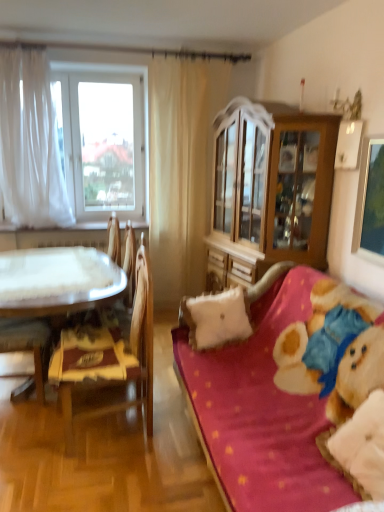
This screenshot has width=384, height=512. What do you see at coordinates (102, 142) in the screenshot?
I see `white sheer curtain at left` at bounding box center [102, 142].

Image resolution: width=384 pixels, height=512 pixels. I want to click on white sheer curtain at left, the 2th curtain positioned from the right, so click(30, 143).

The image size is (384, 512). What do you see at coordinates (260, 412) in the screenshot?
I see `velvet pink couch at right` at bounding box center [260, 412].

What do you see at coordinates (370, 201) in the screenshot? This screenshot has height=512, width=384. I see `metallic silver picture frame at upper right` at bounding box center [370, 201].

Locate an element on the screen. white glossy table at left is located at coordinates (57, 281).

In the scene shown: Which is closer to the camera, (362, 238) or (81, 142)?

The point (362, 238) is closer to the camera.

Which object is more forward, metallic silver picture frame at upper right or white sheer curtain at left?

Positioned in front is metallic silver picture frame at upper right.

Is metallic silver picture frame at upper right taller or shorter than white sheer curtain at left?

Clearly, metallic silver picture frame at upper right is shorter compared to white sheer curtain at left.

Consider the image. Are metallic silver picture frame at upper right and white sheer curtain at left far apart?

metallic silver picture frame at upper right is positioned a significant distance from white sheer curtain at left.

Does white sheer curtain at left, positioned as the first curtain in left-to-right order, have a greater height compared to white sheer curtain at left?

Correct, white sheer curtain at left, positioned as the first curtain in left-to-right order, is much taller as white sheer curtain at left.

Is white sheer curtain at left, the 2th curtain positioned from the right, facing away from white sheer curtain at left?

Yes, white sheer curtain at left, the 2th curtain positioned from the right, is facing away from white sheer curtain at left.

Considering the sizes of objects white sheer curtain at left, positioned as the first curtain in left-to-right order, and white sheer curtain at left in the image provided, who is bigger, white sheer curtain at left, positioned as the first curtain in left-to-right order, or white sheer curtain at left?

With larger size is white sheer curtain at left, positioned as the first curtain in left-to-right order.

From the picture: Can you tell me how much velvet pink couch at right and white glossy table at left differ in facing direction?

There is a 97.4-degree angle between the facing directions of velvet pink couch at right and white glossy table at left.

Considering the relative positions of velvet pink couch at right and white glossy table at left in the image provided, is velvet pink couch at right in front of white glossy table at left?

That is True.

From the image's perspective, would you say velvet pink couch at right is shown under white glossy table at left?

Yes, from the image's perspective, velvet pink couch at right is beneath white glossy table at left.

The width and height of the screenshot is (384, 512). I want to click on table that appears behind the velvet pink couch at right, so click(x=57, y=281).

Considering the relative positions of white sheer curtain at left, the 2th curtain positioned from the right, and velvet pink couch at right in the image provided, is white sheer curtain at left, the 2th curtain positioned from the right, to the right of velvet pink couch at right from the viewer's perspective?

In fact, white sheer curtain at left, the 2th curtain positioned from the right, is to the left of velvet pink couch at right.

From the image's perspective, would you say white sheer curtain at left, positioned as the first curtain in left-to-right order, is positioned over velvet pink couch at right?

Yes, from the image's perspective, white sheer curtain at left, positioned as the first curtain in left-to-right order, is over velvet pink couch at right.

Choose the correct answer: Is white sheer curtain at left, the 2th curtain positioned from the right, inside velvet pink couch at right or outside it?

white sheer curtain at left, the 2th curtain positioned from the right, lies outside velvet pink couch at right.

From a real-world perspective, relative to velvet pink couch at right, is white sheer curtain at left, positioned as the first curtain in left-to-right order, vertically above or below?

From a real-world perspective, white sheer curtain at left, positioned as the first curtain in left-to-right order, is physically above velvet pink couch at right.

Considering the sizes of objects beige fabric curtain at center, which is the 1th curtain from right to left, and white glossy table at left in the image provided, who is bigger, beige fabric curtain at center, which is the 1th curtain from right to left, or white glossy table at left?

white glossy table at left is bigger.

Choose the correct answer: Is beige fabric curtain at center, which is the 1th curtain from right to left, inside white glossy table at left or outside it?

beige fabric curtain at center, which is the 1th curtain from right to left, is spatially situated outside white glossy table at left.

Can you see beige fabric curtain at center, which is counted as the second curtain, starting from the left, touching white glossy table at left?

beige fabric curtain at center, which is counted as the second curtain, starting from the left, is not next to white glossy table at left, and they're not touching.

Can you confirm if beige fabric curtain at center, which is the 1th curtain from right to left, is thinner than white glossy table at left?

Indeed, beige fabric curtain at center, which is the 1th curtain from right to left, has a lesser width compared to white glossy table at left.

Can you confirm if white fluffy pillow at right, arranged as the second pillow when viewed from the back, is positioned to the left of metallic silver picture frame at upper right?

Yes, white fluffy pillow at right, arranged as the second pillow when viewed from the back, is to the left of metallic silver picture frame at upper right.

Considering the sizes of objects white fluffy pillow at right, the second pillow viewed from the left, and metallic silver picture frame at upper right in the image provided, who is shorter, white fluffy pillow at right, the second pillow viewed from the left, or metallic silver picture frame at upper right?

white fluffy pillow at right, the second pillow viewed from the left.

From the image's perspective, is white fluffy pillow at right, which is the 1th pillow from front to back, above metallic silver picture frame at upper right?

No, from the image's perspective, white fluffy pillow at right, which is the 1th pillow from front to back, is not over metallic silver picture frame at upper right.

Is point (236, 328) positioned after point (374, 213)?

That is True.

Looking at this image, from a real-world perspective, between white fluffy pillow at center, the second pillow from the right, and metallic silver picture frame at upper right, who is vertically lower?

white fluffy pillow at center, the second pillow from the right, is physically lower.

Is white fluffy pillow at center, the second pillow from the right, to the right of metallic silver picture frame at upper right from the viewer's perspective?

No.

Considering the sizes of objects white fluffy pillow at center, positioned as the 1th pillow in left-to-right order, and metallic silver picture frame at upper right in the image provided, who is bigger, white fluffy pillow at center, positioned as the 1th pillow in left-to-right order, or metallic silver picture frame at upper right?

white fluffy pillow at center, positioned as the 1th pillow in left-to-right order.

Identify the location of window on the left of metallic silver picture frame at upper right. The width and height of the screenshot is (384, 512). (102, 142).

Identify the location of window behind the white sheer curtain at left, the 2th curtain positioned from the right. The image size is (384, 512). (102, 142).

Considering their positions, is wooden cabinet at center positioned closer to white fluffy pillow at center, positioned as the 1th pillow in left-to-right order, than wooden chair at left?

wooden chair at left is positioned closer to the anchor white fluffy pillow at center, positioned as the 1th pillow in left-to-right order.

Based on their spatial positions, is white glossy table at left or wooden chair at left further from velvet pink couch at right?

The object further to velvet pink couch at right is white glossy table at left.

Estimate the real-world distances between objects in this image. Which object is closer to wooden chair at left, metallic silver picture frame at upper right or velvet pink couch at right?

The object closer to wooden chair at left is velvet pink couch at right.

Based on the photo, estimate the real-world distances between objects in this image. Which object is closer to wooden chair at left, white sheer curtain at left or white fluffy pillow at right, which is the 1th pillow from front to back?

white fluffy pillow at right, which is the 1th pillow from front to back.

Considering their positions, is metallic silver picture frame at upper right positioned closer to white fluffy pillow at center, the 2th pillow viewed from the front, than wooden cabinet at center?

wooden cabinet at center lies closer to white fluffy pillow at center, the 2th pillow viewed from the front, than the other object.

From the image, which object appears to be nearer to wooden chair at left, white sheer curtain at left or white glossy table at left?

white glossy table at left is positioned closer to the anchor wooden chair at left.

Based on their spatial positions, is wooden cabinet at center or velvet-like beige armchair at left further from white fluffy pillow at right, the 1th pillow positioned from the right?

velvet-like beige armchair at left lies further to white fluffy pillow at right, the 1th pillow positioned from the right, than the other object.

Based on their spatial positions, is white fluffy pillow at right, which is the 1th pillow from front to back, or white sheer curtain at left closer to beige fabric curtain at center, which is the 1th curtain from right to left?

white sheer curtain at left is positioned closer to the anchor beige fabric curtain at center, which is the 1th curtain from right to left.

The image size is (384, 512). What are the coordinates of `pillow between velvet pink couch at right and metallic silver picture frame at upper right in the front-back direction` in the screenshot? It's located at click(360, 446).

This screenshot has width=384, height=512. I want to click on pillow between velvet-like beige armchair at left and wooden cabinet at center in the horizontal direction, so click(215, 318).

You are a GUI agent. You are given a task and a screenshot of the screen. Output one action in this format:
    pyautogui.click(x=<x>, y=<y>)
    Task: Click on the pillow positioned between white glossy table at left and beige fabric curtain at center, which is the 1th curtain from right to left, from near to far
    The image size is (384, 512).
    Given the screenshot: What is the action you would take?
    pyautogui.click(x=215, y=318)

At what (x,y) coordinates should I click in order to perform the action: click on chair between white glossy table at left and white fluffy pillow at center, the 2th pillow viewed from the front, from left to right. Please return your answer as a coordinate pair (x, y). The image size is (384, 512). Looking at the image, I should click on (110, 353).